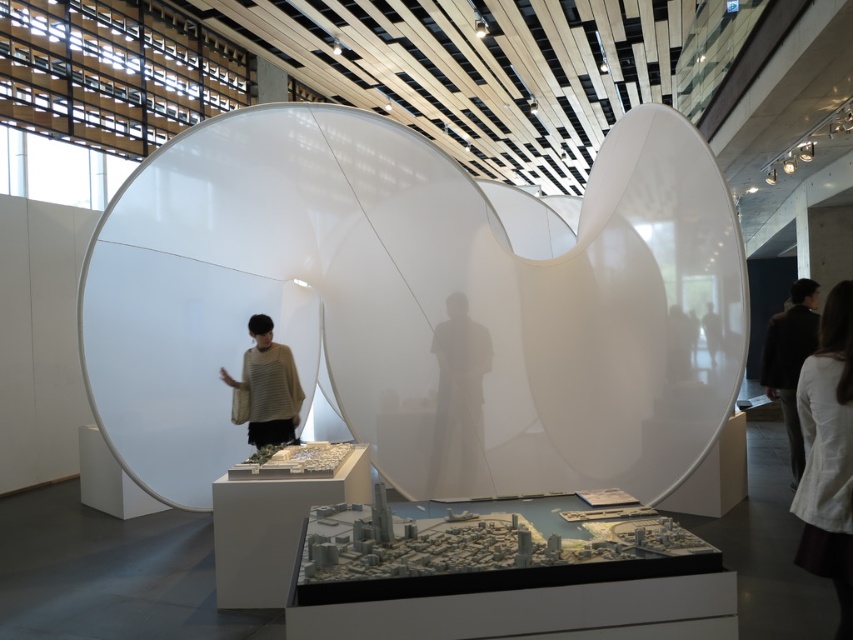
You are an interior designer planning to place a new decorative item in the exhibition space. You have a rectangular box that is 1 meter wide. You see the white fabric at center and the striped sweater at center. Can you determine if the box will fit between them?

The white fabric at center is narrower than the striped sweater at center. Since the box is 1 meter wide, you need to check the distance between them. However, the description only states the relative widths of the objects, not the distance between them. Therefore, it is unclear if the box will fit between them based on the provided information.